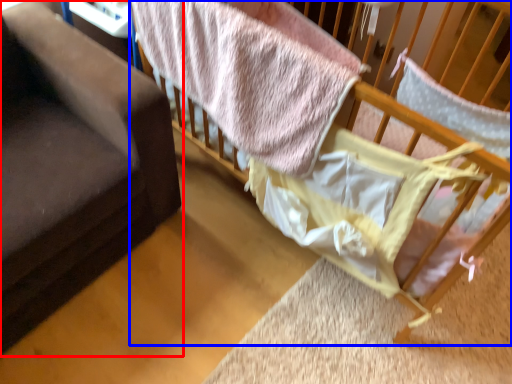
Question: Which point is closer to the camera, furniture (highlighted by a red box) or infant bed (highlighted by a blue box)?

Choices:
 (A) furniture
 (B) infant bed

Answer: (A)